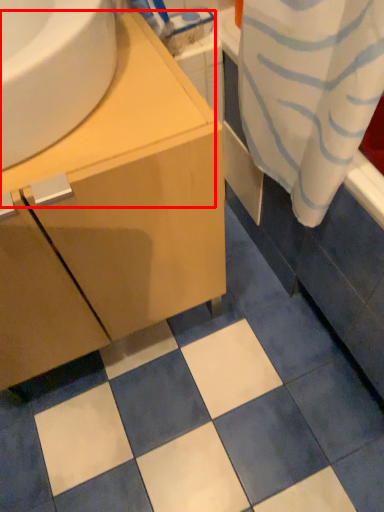
Question: In this image, where is counter top (annotated by the red box) located relative to bathroom cabinet?

Choices:
 (A) left
 (B) right

Answer: (B)